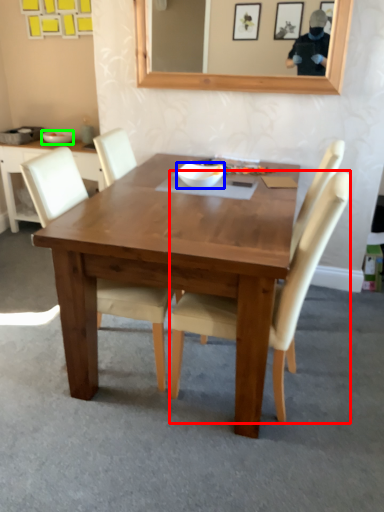
Question: Which object is positioned farthest from chair (highlighted by a red box)? Select from bowl (highlighted by a blue box) and bowl (highlighted by a green box).

Choices:
 (A) bowl
 (B) bowl

Answer: (B)